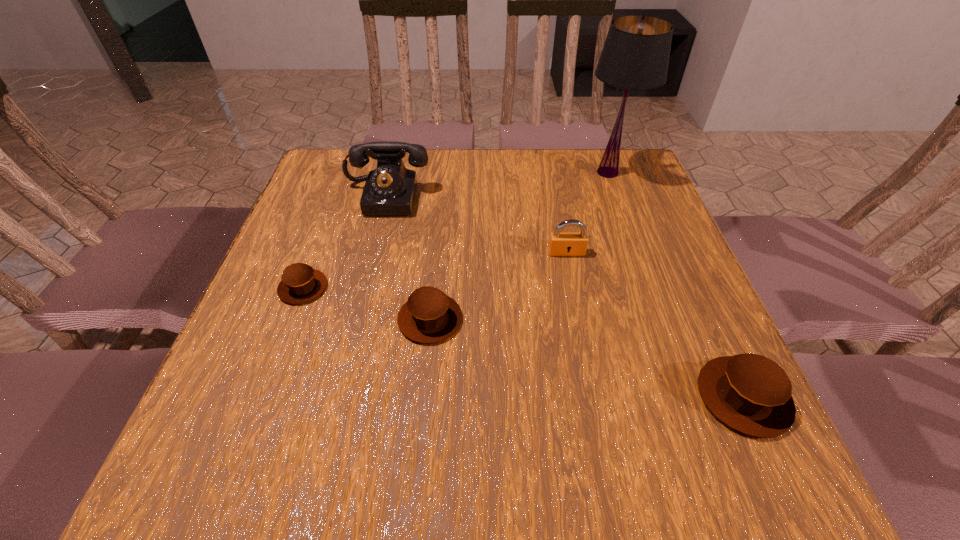
Locate an element on the screen. This screenshot has width=960, height=540. vacant region between the tallest object and the second muffin from right to left is located at coordinates (518, 246).

I want to click on the second closest object to the shortest object, so click(390, 189).

Find the location of a particular element. This screenshot has height=540, width=960. object that stands as the second closest to the telephone is located at coordinates (429, 316).

I want to click on muffin that can be found as the closest to the shortest object, so click(x=429, y=316).

Choose which muffin is the second nearest neighbor to the telephone. Please provide its 2D coordinates. Your answer should be formatted as a tuple, i.e. [(x, y)], where the tuple contains the x and y coordinates of a point satisfying the conditions above.

[(429, 316)]

At what (x,y) coordinates should I click in order to perform the action: click on free spot that satisfies the following two spatial constraints: 1. on the dial of the nearest object; 2. on the left side of the telephone. Please return your answer as a coordinate pair (x, y). The image size is (960, 540). Looking at the image, I should click on (337, 397).

At what (x,y) coordinates should I click in order to perform the action: click on blank space that satisfies the following two spatial constraints: 1. on the front-facing side of the rightmost muffin; 2. on the left side of the tallest object. Please return your answer as a coordinate pair (x, y). The width and height of the screenshot is (960, 540). Looking at the image, I should click on (689, 397).

Where is `free point that satisfies the following two spatial constraints: 1. on the front-facing side of the nearest muffin; 2. on the left side of the lampshade`? free point that satisfies the following two spatial constraints: 1. on the front-facing side of the nearest muffin; 2. on the left side of the lampshade is located at coordinates (689, 397).